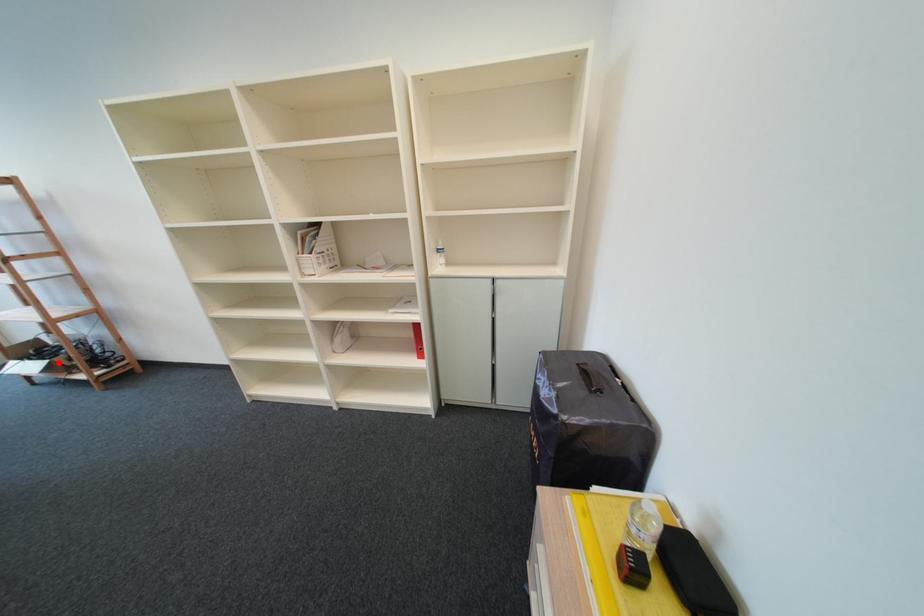
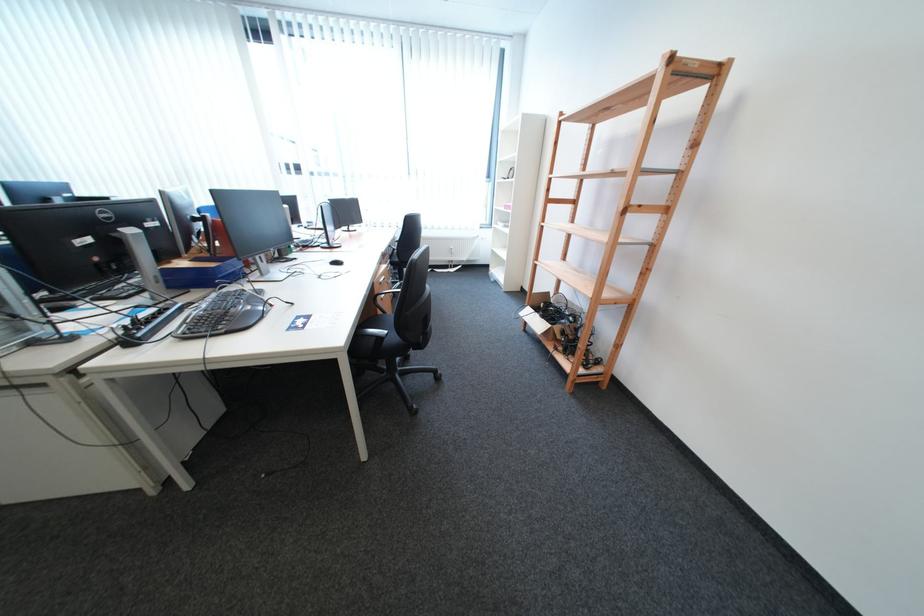
The point at the highlighted location is marked in the first image. Where is the corresponding point in the second image?

(562, 326)